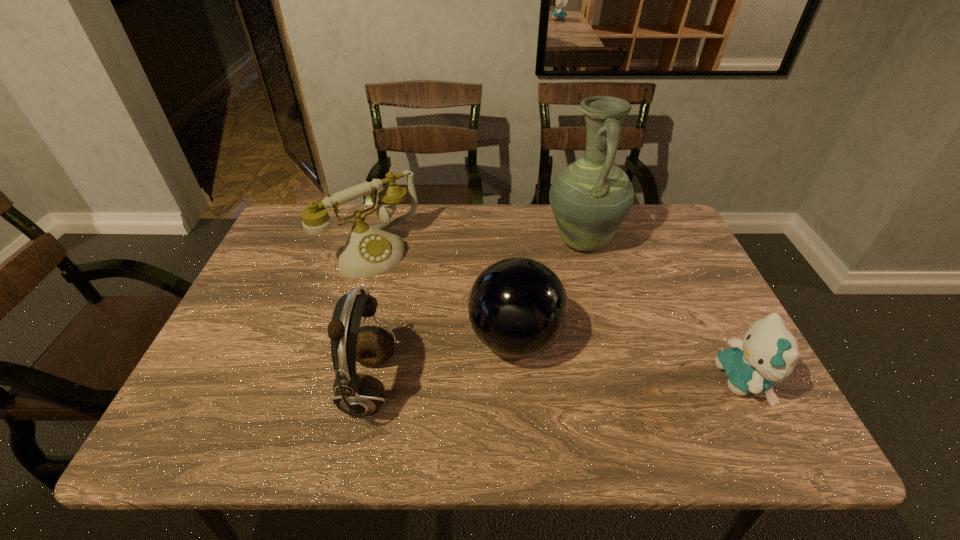
Where is `earphone`? earphone is located at coordinates (360, 395).

Where is `kitten`? This screenshot has height=540, width=960. kitten is located at coordinates (768, 353).

Locate an element on the screen. The height and width of the screenshot is (540, 960). the rightmost object is located at coordinates (768, 353).

You are a GUI agent. You are given a task and a screenshot of the screen. Output one action in this format:
    pyautogui.click(x=<x>, y=<y>)
    Task: Click on the telephone
    This screenshot has height=540, width=960.
    Given the screenshot: What is the action you would take?
    pyautogui.click(x=369, y=251)

Locate an element on the screen. This screenshot has width=960, height=540. bowling ball is located at coordinates (518, 307).

The image size is (960, 540). I want to click on pitcher, so click(x=590, y=198).

I want to click on vacant area situated on the ear pads of the second tallest object, so click(x=518, y=386).

In order to click on free region located 0.240m on the face of the rightmost object in this screenshot , I will do `click(608, 381)`.

Locate an element on the screen. This screenshot has height=540, width=960. vacant region located 0.330m on the face of the rightmost object is located at coordinates (566, 381).

Image resolution: width=960 pixels, height=540 pixels. In order to click on vacant space located 0.080m on the face of the rightmost object in this screenshot , I will do `click(682, 381)`.